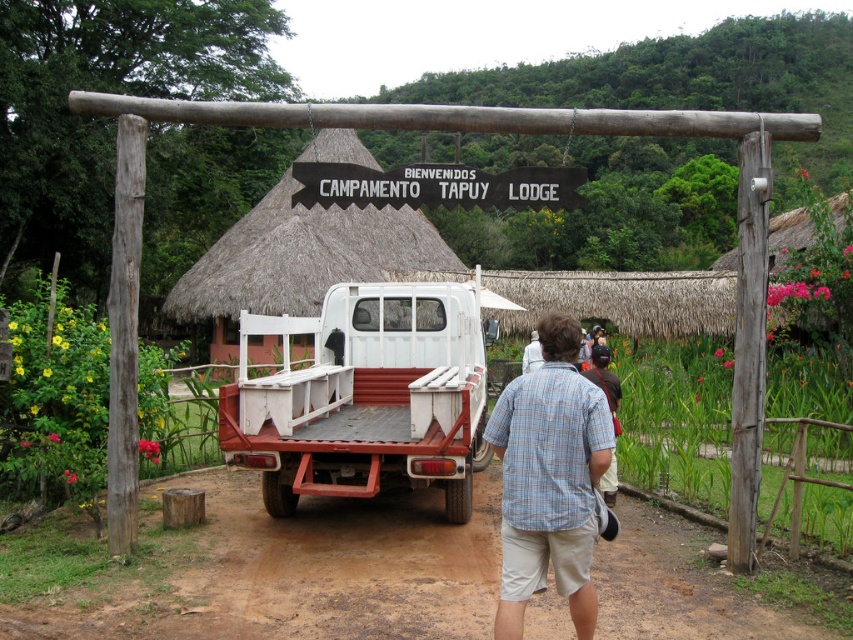
Question: Can you confirm if brown dirt track at center is smaller than thatched straw hut at center?

Choices:
 (A) no
 (B) yes

Answer: (B)

Question: Which of the following is the closest to the observer?

Choices:
 (A) (280, 273)
 (B) (393, 337)

Answer: (B)

Question: Which point is closer to the camera?

Choices:
 (A) blue plaid shirt at center
 (B) brown dirt track at center
 (C) thatched straw hut at center

Answer: (A)

Question: Considering the real-world distances, which object is closest to the thatched straw hut at center?

Choices:
 (A) brown dirt track at center
 (B) blue plaid shirt at center

Answer: (A)

Question: Does brown dirt track at center appear over thatched straw hut at center?

Choices:
 (A) yes
 (B) no

Answer: (B)

Question: Is white matte truck at center further to the viewer compared to blue plaid shirt at center?

Choices:
 (A) yes
 (B) no

Answer: (A)